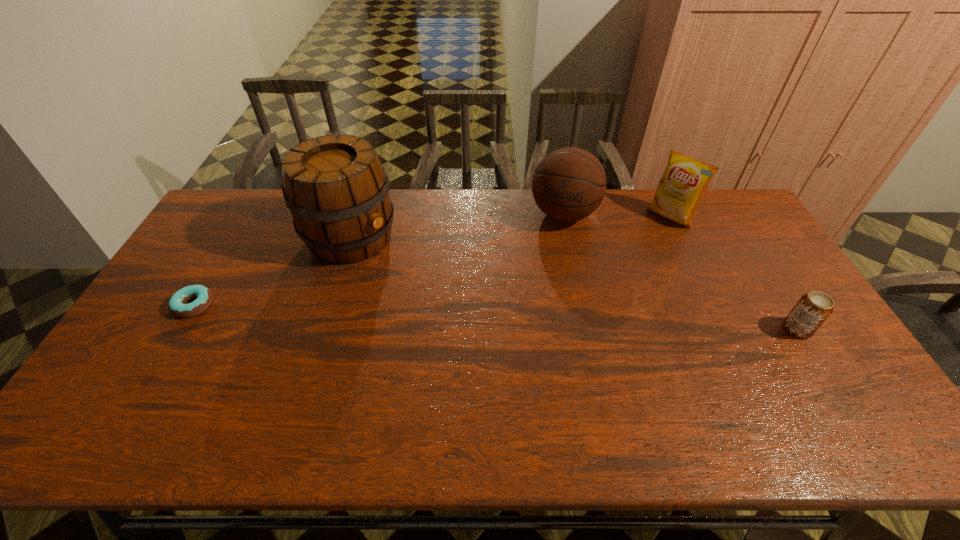
The height and width of the screenshot is (540, 960). Identify the location of the shortest object. (177, 306).

Where is `doughnut`? doughnut is located at coordinates (177, 306).

The width and height of the screenshot is (960, 540). Identify the location of beer can. [x=812, y=310].

Locate an element on the screen. the rightmost object is located at coordinates (812, 310).

This screenshot has height=540, width=960. I want to click on cider, so click(x=337, y=190).

Where is `the tallest object`? The image size is (960, 540). the tallest object is located at coordinates (337, 190).

Find the location of a particular element. Image resolution: width=960 pixels, height=540 pixels. the third object from left to right is located at coordinates (569, 184).

What are the coordinates of `crisp (potato chip)` in the screenshot? It's located at (681, 189).

Find the location of a particular element. The height and width of the screenshot is (540, 960). vacant region located 0.300m on the right of the shortest object is located at coordinates (317, 305).

Locate an element on the screen. free space located 0.140m on the front of the rightmost object is located at coordinates (833, 386).